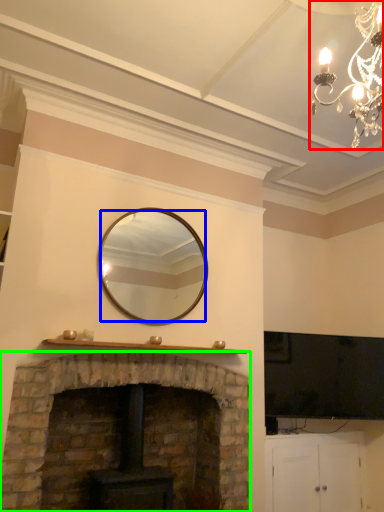
Question: Which object is positioned farthest from lamp (highlighted by a red box)? Select from mirror (highlighted by a blue box) and fireplace (highlighted by a green box).

Choices:
 (A) mirror
 (B) fireplace

Answer: (B)